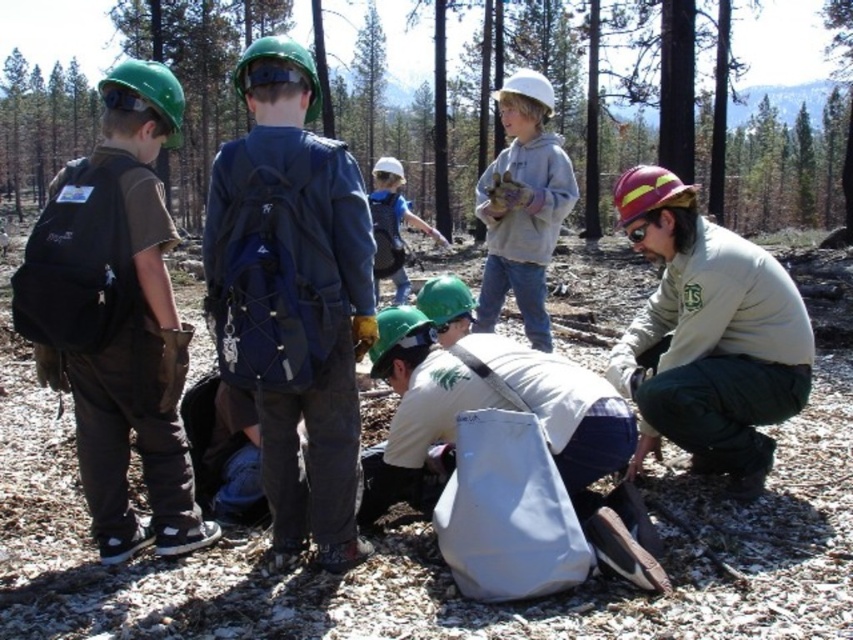
Question: Which object appears farthest from the camera in this image?

Choices:
 (A) black fabric backpack at left
 (B) white matte helmet at center
 (C) green helmeted person at lower right

Answer: (B)

Question: Which point appears farthest from the camera in this image?

Choices:
 (A) (287, 216)
 (B) (86, 253)

Answer: (B)

Question: Is brown textured dirt at center positioned in front of black fabric backpack at left?

Choices:
 (A) no
 (B) yes

Answer: (A)

Question: Estimate the real-world distances between objects in this image. Which object is closer to the brown textured dirt at center?

Choices:
 (A) white matte helmet at center
 (B) green helmeted person at lower right

Answer: (A)

Question: Is matte blue backpack at center to the right of green helmeted person at lower right from the viewer's perspective?

Choices:
 (A) no
 (B) yes

Answer: (A)

Question: Does black fabric backpack at left have a larger size compared to white matte helmet at center?

Choices:
 (A) yes
 (B) no

Answer: (B)